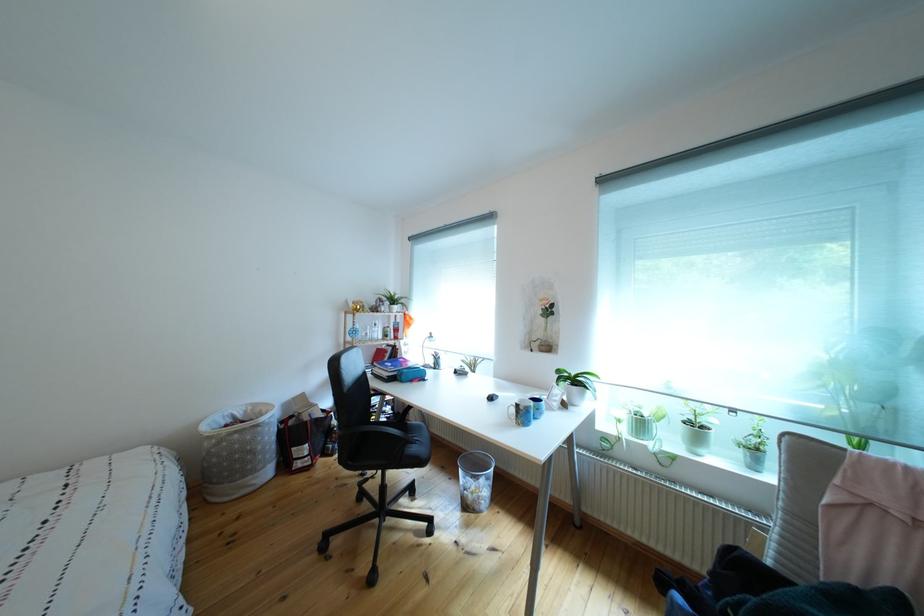
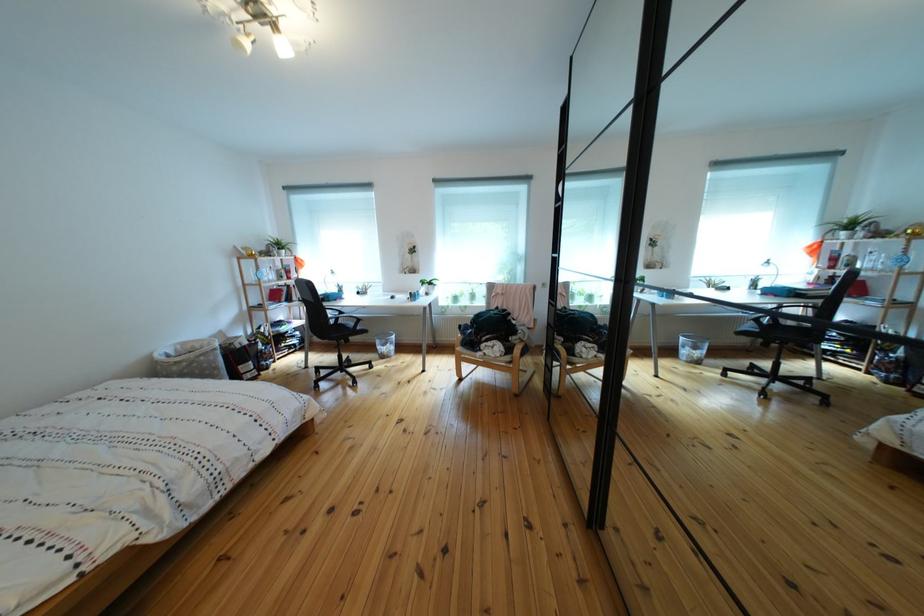
Find the pixel in the second image that matches [257,418] in the first image.

(187, 355)